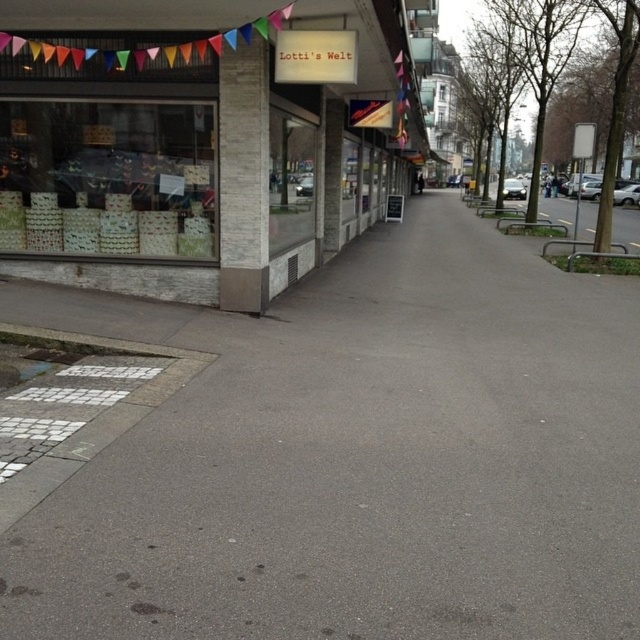
You are a delivery person who needs to place a package on the sidewalk. The package requires a flat surface that is at least 2.5 meters away from the matte glass storefront at upper left. Can the gray asphalt pavement at center meet this requirement?

The gray asphalt pavement at center is 3.00 meters from the matte glass storefront at upper left, which is more than the required 2.5 meters. Therefore, the gray asphalt pavement at center can be used to place the package.

You are a delivery person who needs to walk from the matte glass storefront at upper left to the gray asphalt pavement at center. Which direction should you head?

You should head to the right, as the gray asphalt pavement at center is located to the right of the matte glass storefront at upper left.

You are standing on the sidewalk in the image and want to walk to the gray asphalt pavement at center. Which direction should you head towards?

The gray asphalt pavement at center is located at point coordinates, so you should head towards the center of the image to reach it.